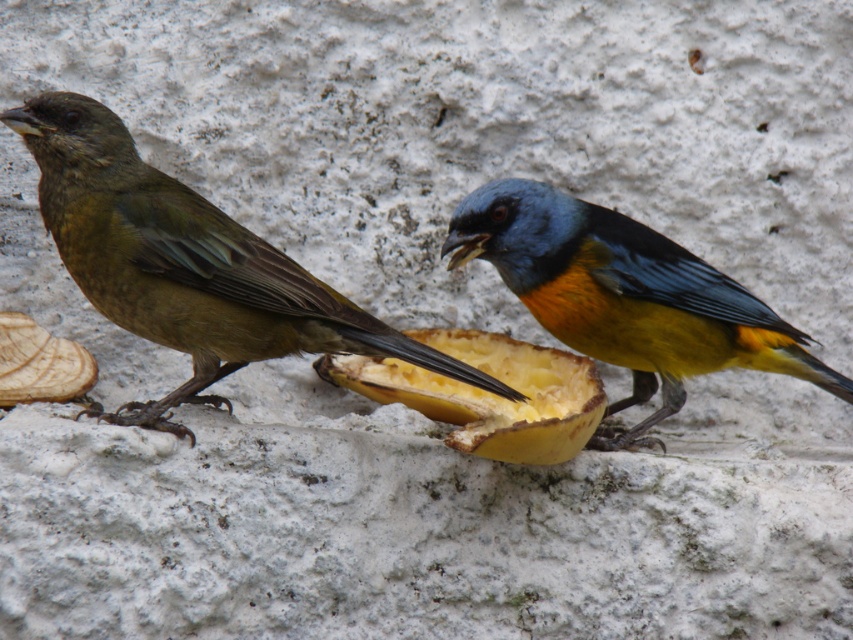
Question: Which point is closer to the camera?

Choices:
 (A) brown matte bird at left
 (B) yellow matte fruit at center

Answer: (B)

Question: Which point appears closest to the camera in this image?

Choices:
 (A) (161, 220)
 (B) (624, 221)
 (C) (332, 356)

Answer: (A)

Question: Does brown matte bird at left appear on the right side of yellow matte fruit at center?

Choices:
 (A) no
 (B) yes

Answer: (A)

Question: Among these points, which one is nearest to the camera?

Choices:
 (A) pyautogui.click(x=318, y=324)
 (B) pyautogui.click(x=321, y=362)

Answer: (A)

Question: Does brown matte bird at left have a lesser width compared to yellow matte fruit at center?

Choices:
 (A) yes
 (B) no

Answer: (B)

Question: From the image, what is the correct spatial relationship of brown matte bird at left in relation to blue/yellow feathers at center?

Choices:
 (A) above
 (B) below

Answer: (A)